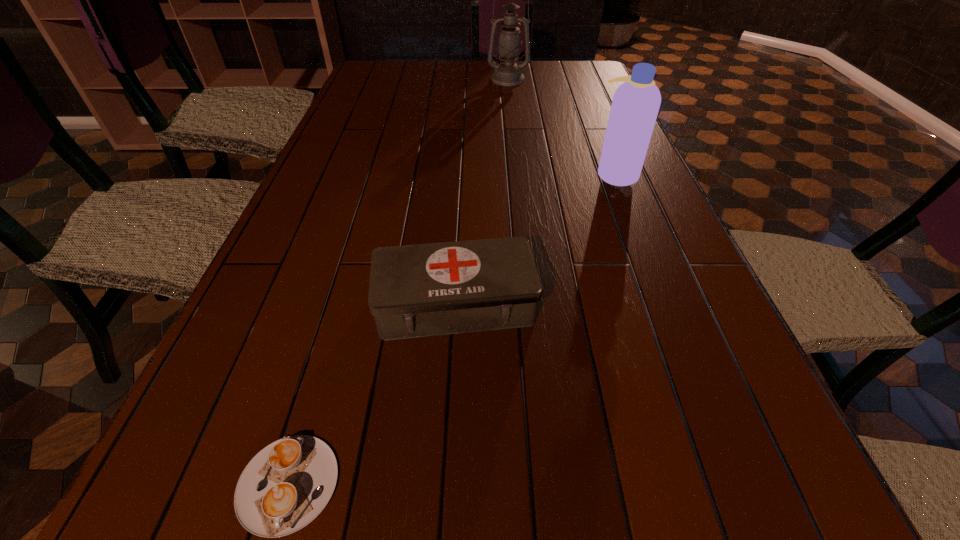
What are the coordinates of `vacant space that is in between the farthest object and the first-aid kit` in the screenshot? It's located at (482, 192).

This screenshot has height=540, width=960. I want to click on empty space that is in between the first-aid kit and the shampoo, so click(x=536, y=239).

Where is `unoccupied position between the first-aid kit and the third shortest object`? This screenshot has height=540, width=960. unoccupied position between the first-aid kit and the third shortest object is located at coordinates (536, 239).

Find the location of a particular element. This screenshot has width=960, height=540. vacant space that is in between the first-aid kit and the farthest object is located at coordinates (x=482, y=192).

Where is `empty location between the first-aid kit and the second farthest object`? This screenshot has width=960, height=540. empty location between the first-aid kit and the second farthest object is located at coordinates point(536,239).

Identify which object is located as the third nearest to the cappuccino. Please provide its 2D coordinates. Your answer should be formatted as a tuple, i.e. [(x, y)], where the tuple contains the x and y coordinates of a point satisfying the conditions above.

[(508, 73)]

At what (x,y) coordinates should I click in order to perform the action: click on object that is the third closest one to the first-aid kit. Please return your answer as a coordinate pair (x, y). The height and width of the screenshot is (540, 960). Looking at the image, I should click on (508, 73).

You are a GUI agent. You are given a task and a screenshot of the screen. Output one action in this format:
    pyautogui.click(x=<x>, y=<y>)
    Task: Click on the vacant space that satisfies the following two spatial constraints: 1. on the back side of the nearest object; 2. on the right side of the rightmost object
    Image resolution: width=960 pixels, height=540 pixels.
    Given the screenshot: What is the action you would take?
    pyautogui.click(x=380, y=174)

Locate an element on the screen. free space that satisfies the following two spatial constraints: 1. on the back side of the oil lamp; 2. on the right side of the shortest object is located at coordinates (408, 79).

Identify the location of vacant space that satisfies the following two spatial constraints: 1. on the back side of the tallest object; 2. on the left side of the third tallest object. (468, 79).